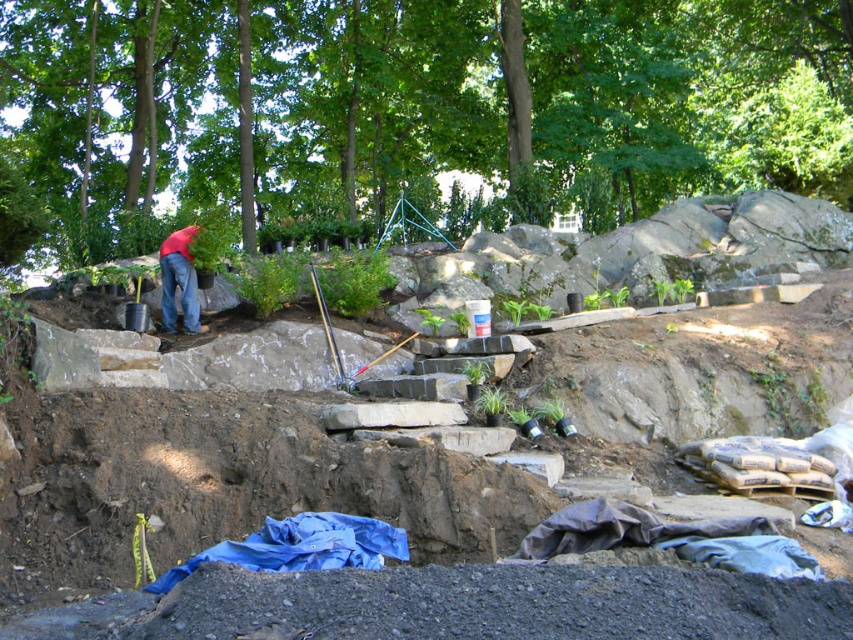
Question: Which point is farther from the camera taking this photo?

Choices:
 (A) (97, 394)
 (B) (164, 266)

Answer: (B)

Question: Which point is closer to the camera?

Choices:
 (A) (199, 323)
 (B) (453, 458)

Answer: (B)

Question: Can you confirm if natural stone steps at upper center is thinner than jeans at left?

Choices:
 (A) yes
 (B) no

Answer: (A)

Question: Where is natural stone steps at upper center located in relation to jeans at left in the image?

Choices:
 (A) left
 (B) right

Answer: (B)

Question: Does natural stone steps at upper center appear on the left side of jeans at left?

Choices:
 (A) no
 (B) yes

Answer: (A)

Question: Among these points, which one is nearest to the camera?

Choices:
 (A) tap(164, 316)
 (B) tap(552, 582)

Answer: (B)